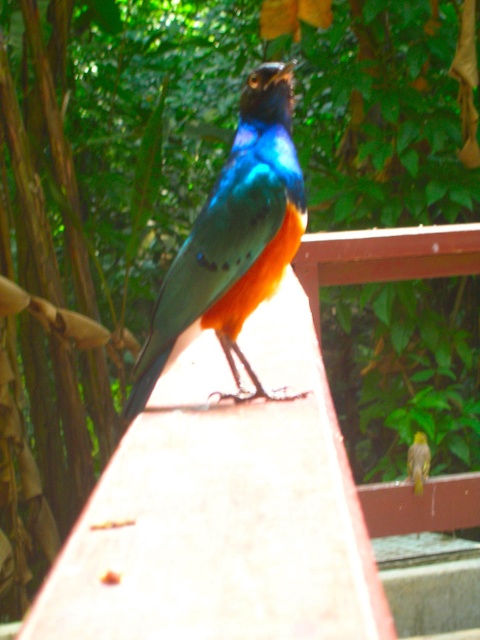
Question: Which of the following is the closest to the observer?

Choices:
 (A) (416, 481)
 (B) (214, 237)

Answer: (B)

Question: Does shiny metallic bird at center have a greater width compared to yellow textured bird at center?

Choices:
 (A) no
 (B) yes

Answer: (B)

Question: Which point is closer to the camera taking this photo?

Choices:
 (A) (422, 445)
 (B) (252, 208)

Answer: (B)

Question: Is shiny metallic bird at center smaller than yellow textured bird at center?

Choices:
 (A) yes
 (B) no

Answer: (B)

Question: Is shiny metallic bird at center bigger than yellow textured bird at center?

Choices:
 (A) no
 (B) yes

Answer: (B)